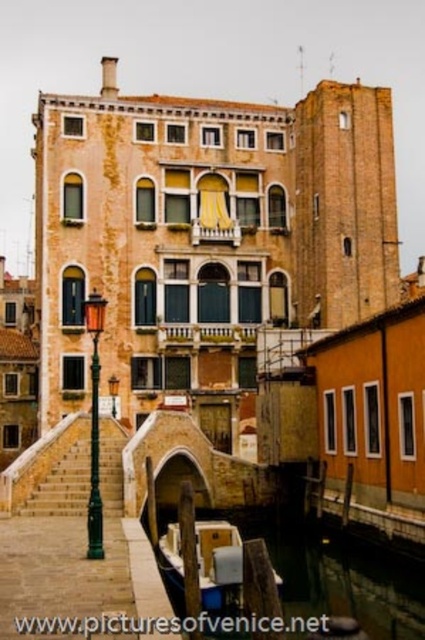
Does wooden boat at lower center appear on the right side of green painted metal streetlamp at left?

Indeed, wooden boat at lower center is positioned on the right side of green painted metal streetlamp at left.

Is point (238, 609) behind point (93, 358)?

No, it is not.

The image size is (425, 640). Find the location of `wooden boat at lower center`. wooden boat at lower center is located at coordinates (220, 566).

Where is `yellow stone stairs at lower left`? yellow stone stairs at lower left is located at coordinates (56, 476).

Is yellow stone stairs at lower left positioned behind wooden boat at lower center?

Yes, yellow stone stairs at lower left is behind wooden boat at lower center.

The image size is (425, 640). What do you see at coordinates (56, 476) in the screenshot? I see `yellow stone stairs at lower left` at bounding box center [56, 476].

The height and width of the screenshot is (640, 425). Identify the location of yellow stone stairs at lower left. (56, 476).

Does yellow stone stairs at lower left have a greater height compared to green painted metal streetlamp at left?

No, yellow stone stairs at lower left is not taller than green painted metal streetlamp at left.

Between yellow stone stairs at lower left and green painted metal streetlamp at left, which one appears on the left side from the viewer's perspective?

green painted metal streetlamp at left is more to the left.

Between point (73, 452) and point (93, 314), which one is positioned in front?

Positioned in front is point (93, 314).

What are the coordinates of `yellow stone stairs at lower left` in the screenshot? It's located at (56, 476).